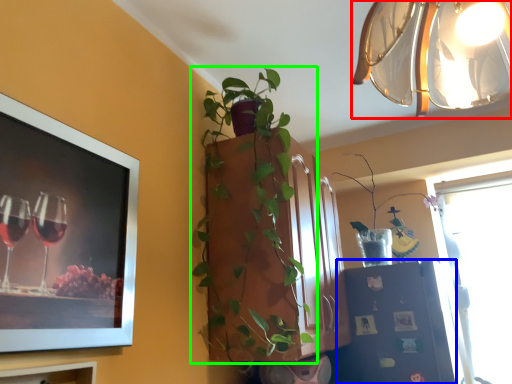
Question: Based on their relative distances, which object is nearer to lamp (highlighted by a red box)? Choose from shelf (highlighted by a blue box) and houseplant (highlighted by a green box).

Choices:
 (A) shelf
 (B) houseplant

Answer: (B)